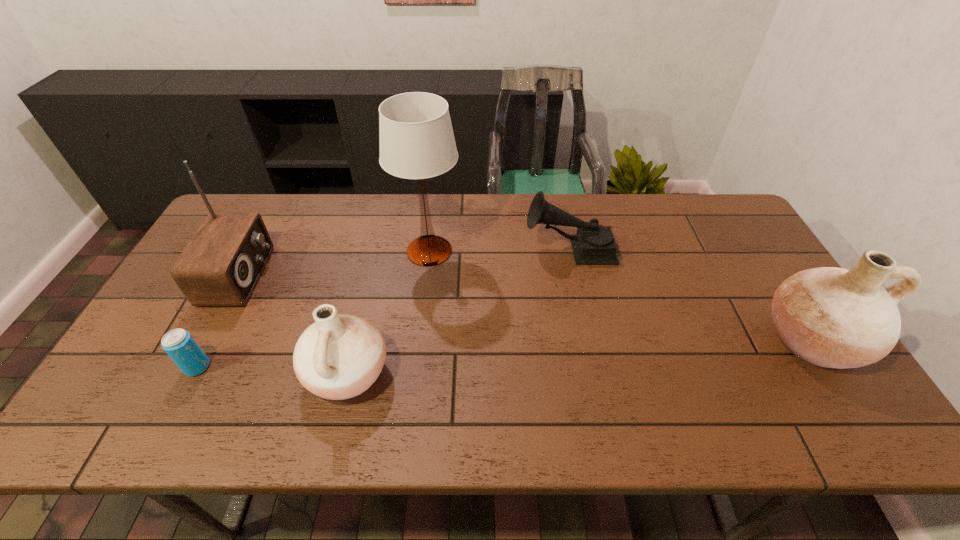
Image resolution: width=960 pixels, height=540 pixels. Find the location of `vacant space located 0.090m on the front-facing side of the radio receiver`. vacant space located 0.090m on the front-facing side of the radio receiver is located at coordinates (297, 276).

I want to click on free location located above the cylindrical shade of the tallest object, so click(578, 251).

In order to click on blank space located 0.210m from the horn of the fifth object from left to right in this screenshot , I will do `click(458, 248)`.

You are a GUI agent. You are given a task and a screenshot of the screen. Output one action in this format:
    pyautogui.click(x=<x>, y=<y>)
    Task: Click on the vacant region located from the horn of the fifth object from left to right
    
    Given the screenshot: What is the action you would take?
    pyautogui.click(x=480, y=248)

I want to click on free region located 0.060m from the horn of the fifth object from left to right, so click(506, 248).

You are a GUI agent. You are given a task and a screenshot of the screen. Output one action in this format:
    pyautogui.click(x=<x>, y=<y>)
    Task: Click on the vacant space located on the right of the shortest object
    This screenshot has height=540, width=960.
    Given the screenshot: What is the action you would take?
    pyautogui.click(x=271, y=367)

At what (x,y) coordinates should I click in order to perform the action: click on table lamp situated at the far edge. Please return your answer as a coordinate pair (x, y). The height and width of the screenshot is (540, 960). Looking at the image, I should click on (416, 140).

The width and height of the screenshot is (960, 540). I want to click on phonograph_record that is at the far edge, so click(x=593, y=244).

This screenshot has height=540, width=960. In order to click on soda can that is at the near edge in this screenshot , I will do `click(179, 344)`.

What are the coordinates of `radio receiver located in the left edge section of the desktop` in the screenshot? It's located at (220, 266).